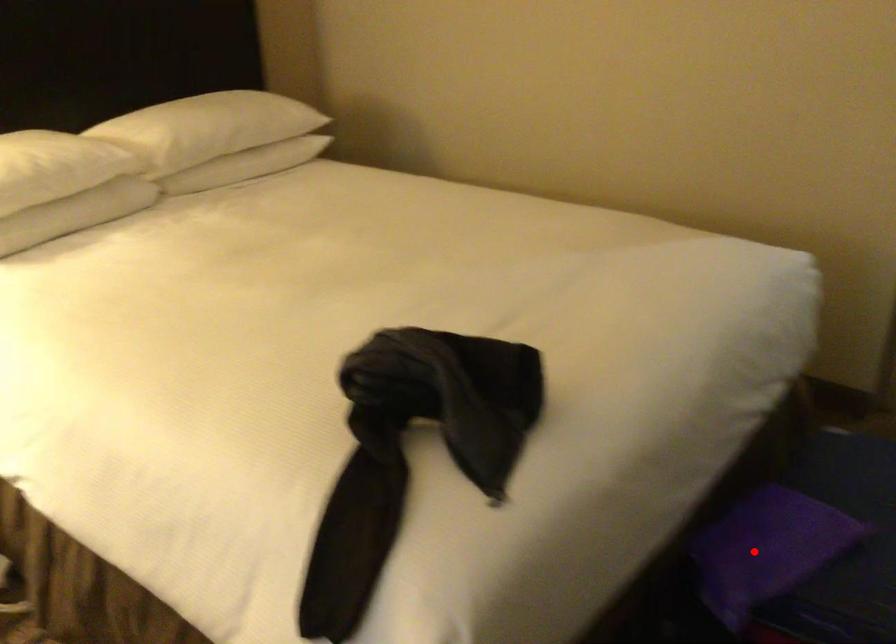
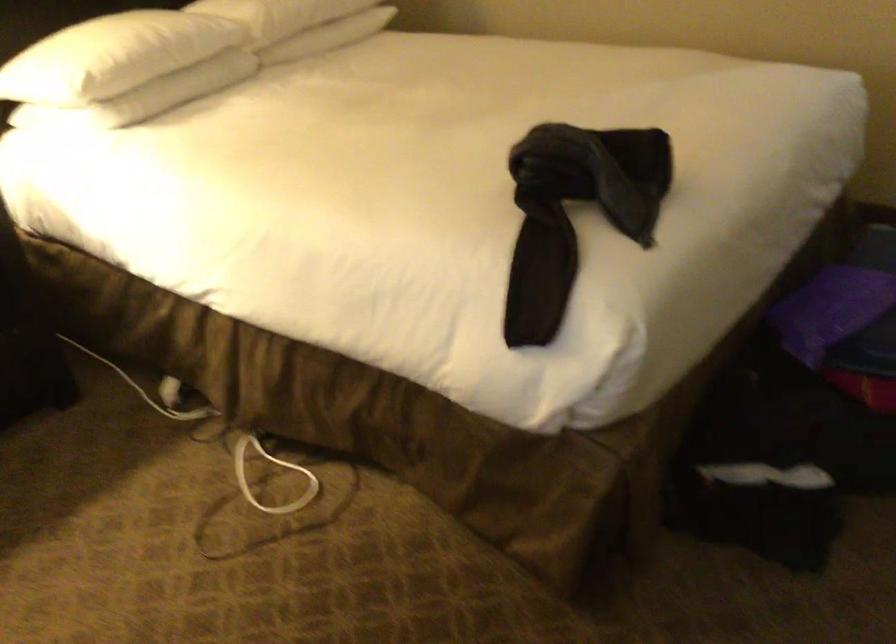
Question: I am providing you with two images of the same scene from different viewpoints. Image1 has a red point marked. In image2, the corresponding 3D location appears at what relative position? Reply with the corresponding letter.

Choices:
 (A) Closer
 (B) Farther

Answer: (B)